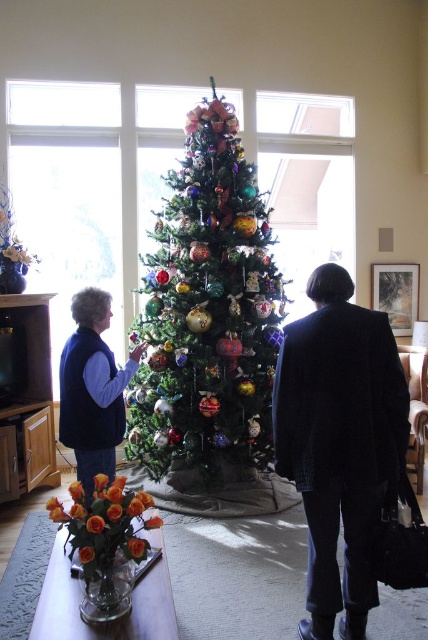
You are a delivery person who needs to place a package on the table with orange roses. The package is 1 foot wide. Is there enough space between the green textured christmas tree at center and the table with orange roses to move the package?

The distance between the green textured christmas tree at center and the table with orange roses is 11.34 feet, so yes, there is enough space to move the 1 foot wide package between them.

Where is the green textured christmas tree at center located in the image?

The green textured christmas tree at center is located at point [208,314].

You are planning to take a photo of the green textured christmas tree at center and the velvet blue vest at left. Which object should you focus on first if you want to capture both in a single frame without moving the camera?

The green textured christmas tree at center is larger in size than the velvet blue vest at left, so you should focus on the green textured christmas tree at center first to ensure it fills the frame appropriately before adjusting for the smaller velvet blue vest at left.